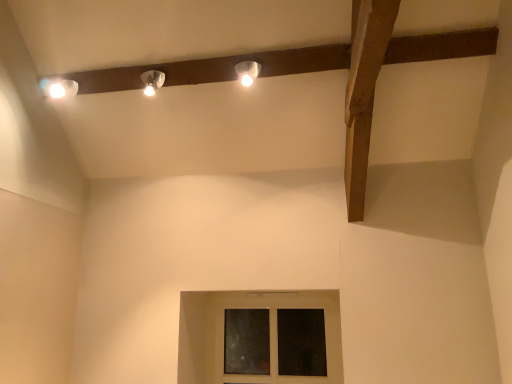
Identify the location of transparent glass window at center. (277, 331).

This screenshot has width=512, height=384. What do you see at coordinates (277, 331) in the screenshot? I see `transparent glass window at center` at bounding box center [277, 331].

Find the location of `matte white lamp at upper center, acting as the second lamp starting from the right`. matte white lamp at upper center, acting as the second lamp starting from the right is located at coordinates (152, 81).

What do you see at coordinates (247, 72) in the screenshot? I see `matte white lamp at upper center, which is counted as the second lamp, starting from the left` at bounding box center [247, 72].

Identify the location of transparent glass window at center. (277, 331).

From a real-world perspective, who is located lower, matte white lamp at upper center, acting as the second lamp starting from the right, or transparent glass window at center?

From a 3D spatial view, transparent glass window at center is below.

Is matte white lamp at upper center, which is the first lamp in left-to-right order, shorter than transparent glass window at center?

Indeed, matte white lamp at upper center, which is the first lamp in left-to-right order, has a lesser height compared to transparent glass window at center.

Is matte white lamp at upper center, acting as the second lamp starting from the right, bigger or smaller than transparent glass window at center?

matte white lamp at upper center, acting as the second lamp starting from the right, is smaller than transparent glass window at center.

Is matte white lamp at upper center, which is the first lamp in left-to-right order, closer to camera compared to transparent glass window at center?

Yes, matte white lamp at upper center, which is the first lamp in left-to-right order, is in front of transparent glass window at center.

Is transparent glass window at center not near matte white lamp at upper center, acting as the second lamp starting from the right?

transparent glass window at center is far away from matte white lamp at upper center, acting as the second lamp starting from the right.

Which is nearer, (327,379) or (162,78)?

Clearly, point (327,379) is more distant from the camera than point (162,78).

Is transparent glass window at center shorter than matte white lamp at upper center, acting as the second lamp starting from the right?

Incorrect, the height of transparent glass window at center does not fall short of that of matte white lamp at upper center, acting as the second lamp starting from the right.

Based on the photo, can you tell me how much transparent glass window at center and matte white lamp at upper center, which is the first lamp in left-to-right order, differ in facing direction?

The angle between the facing direction of transparent glass window at center and the facing direction of matte white lamp at upper center, which is the first lamp in left-to-right order, is 2.67 degrees.

You are a GUI agent. You are given a task and a screenshot of the screen. Output one action in this format:
    pyautogui.click(x=<x>, y=<y>)
    Task: Click on the window located underneath the matte white lamp at upper center, which is counted as the second lamp, starting from the left (from a real-world perspective)
    
    Given the screenshot: What is the action you would take?
    pyautogui.click(x=277, y=331)

Visually, is matte white lamp at upper center, the 1th lamp in the right-to-left sequence, positioned to the left or to the right of transparent glass window at center?

In the image, matte white lamp at upper center, the 1th lamp in the right-to-left sequence, appears on the left side of transparent glass window at center.

Based on the photo, which point is more forward, (253,64) or (335,323)?

The point (253,64) is in front.

Is matte white lamp at upper center, the 1th lamp in the right-to-left sequence, looking in the opposite direction of transparent glass window at center?

No, matte white lamp at upper center, the 1th lamp in the right-to-left sequence,'s orientation is not away from transparent glass window at center.

Is matte white lamp at upper center, which is counted as the second lamp, starting from the left, inside transparent glass window at center?

That's incorrect, matte white lamp at upper center, which is counted as the second lamp, starting from the left, is not inside transparent glass window at center.

From a real-world perspective, which object stands above the other?

matte white lamp at upper center, which is counted as the second lamp, starting from the left, from a real-world perspective.

In terms of width, does transparent glass window at center look wider or thinner when compared to matte white lamp at upper center, the 1th lamp in the right-to-left sequence?

In the image, transparent glass window at center appears to be more narrow than matte white lamp at upper center, the 1th lamp in the right-to-left sequence.

Looking at this image, in terms of height, does matte white lamp at upper center, which is counted as the second lamp, starting from the left, look taller or shorter compared to matte white lamp at upper center, which is the first lamp in left-to-right order?

Considering their sizes, matte white lamp at upper center, which is counted as the second lamp, starting from the left, has less height than matte white lamp at upper center, which is the first lamp in left-to-right order.

Relative to matte white lamp at upper center, acting as the second lamp starting from the right, is matte white lamp at upper center, the 1th lamp in the right-to-left sequence, in front or behind?

matte white lamp at upper center, the 1th lamp in the right-to-left sequence, is in front of matte white lamp at upper center, acting as the second lamp starting from the right.

Could you tell me if matte white lamp at upper center, the 1th lamp in the right-to-left sequence, is turned towards matte white lamp at upper center, acting as the second lamp starting from the right?

No, matte white lamp at upper center, the 1th lamp in the right-to-left sequence, does not turn towards matte white lamp at upper center, acting as the second lamp starting from the right.

Considering the points (243, 81) and (145, 87), which point is behind, point (243, 81) or point (145, 87)?

The point (145, 87) is farther.

Consider the image. Does matte white lamp at upper center, acting as the second lamp starting from the right, have a larger size compared to matte white lamp at upper center, which is counted as the second lamp, starting from the left?

Correct, matte white lamp at upper center, acting as the second lamp starting from the right, is larger in size than matte white lamp at upper center, which is counted as the second lamp, starting from the left.

Does matte white lamp at upper center, acting as the second lamp starting from the right, have a greater height compared to matte white lamp at upper center, which is counted as the second lamp, starting from the left?

Correct, matte white lamp at upper center, acting as the second lamp starting from the right, is much taller as matte white lamp at upper center, which is counted as the second lamp, starting from the left.

Is matte white lamp at upper center, which is the first lamp in left-to-right order, situated inside matte white lamp at upper center, which is counted as the second lamp, starting from the left, or outside?

matte white lamp at upper center, which is the first lamp in left-to-right order, is not inside matte white lamp at upper center, which is counted as the second lamp, starting from the left, it's outside.

This screenshot has height=384, width=512. In the image, there is a matte white lamp at upper center, acting as the second lamp starting from the right. Identify the location of window below it (from a real-world perspective). (277, 331).

At what (x,y) coordinates should I click in order to perform the action: click on window that appears below the matte white lamp at upper center, which is the first lamp in left-to-right order (from the image's perspective). Please return your answer as a coordinate pair (x, y). Looking at the image, I should click on (277, 331).

Estimate the real-world distances between objects in this image. Which object is further from matte white lamp at upper center, acting as the second lamp starting from the right, transparent glass window at center or matte white lamp at upper center, which is counted as the second lamp, starting from the left?

Based on the image, transparent glass window at center appears to be further to matte white lamp at upper center, acting as the second lamp starting from the right.

Which object lies nearer to the anchor point matte white lamp at upper center, which is counted as the second lamp, starting from the left, matte white lamp at upper center, which is the first lamp in left-to-right order, or transparent glass window at center?

The object closer to matte white lamp at upper center, which is counted as the second lamp, starting from the left, is matte white lamp at upper center, which is the first lamp in left-to-right order.

From the image, which object appears to be farther from matte white lamp at upper center, acting as the second lamp starting from the right, matte white lamp at upper center, which is counted as the second lamp, starting from the left, or transparent glass window at center?

Among the two, transparent glass window at center is located further to matte white lamp at upper center, acting as the second lamp starting from the right.

From the image, which object appears to be farther from transparent glass window at center, matte white lamp at upper center, acting as the second lamp starting from the right, or matte white lamp at upper center, the 1th lamp in the right-to-left sequence?

The object further to transparent glass window at center is matte white lamp at upper center, acting as the second lamp starting from the right.

Estimate the real-world distances between objects in this image. Which object is further from transparent glass window at center, matte white lamp at upper center, which is counted as the second lamp, starting from the left, or matte white lamp at upper center, which is the first lamp in left-to-right order?

matte white lamp at upper center, which is the first lamp in left-to-right order, is positioned further to the anchor transparent glass window at center.

Based on their spatial positions, is transparent glass window at center or matte white lamp at upper center, which is the first lamp in left-to-right order, closer to matte white lamp at upper center, the 1th lamp in the right-to-left sequence?

matte white lamp at upper center, which is the first lamp in left-to-right order, lies closer to matte white lamp at upper center, the 1th lamp in the right-to-left sequence, than the other object.

The image size is (512, 384). Find the location of `lamp between matte white lamp at upper center, the 1th lamp in the right-to-left sequence, and transparent glass window at center vertically`. lamp between matte white lamp at upper center, the 1th lamp in the right-to-left sequence, and transparent glass window at center vertically is located at coordinates (152, 81).